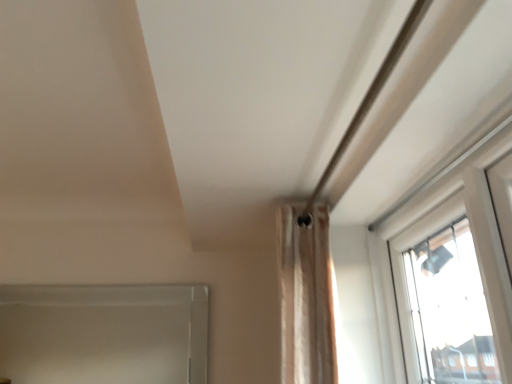
What do you see at coordinates (104, 333) in the screenshot? I see `clear glass window frame at lower left` at bounding box center [104, 333].

What are the coordinates of `clear glass window frame at lower left` in the screenshot? It's located at (104, 333).

The width and height of the screenshot is (512, 384). Describe the element at coordinates (306, 298) in the screenshot. I see `beige fabric curtain at center` at that location.

In order to face beige fabric curtain at center, should I rotate leftwards or rightwards?

A 4.991 degree turn to the right will do.

Locate an element on the screen. The image size is (512, 384). beige fabric curtain at center is located at coordinates (306, 298).

Identify the location of clear glass window frame at lower left. (104, 333).

Considering the positions of objects clear glass window frame at lower left and beige fabric curtain at center in the image provided, who is more to the left, clear glass window frame at lower left or beige fabric curtain at center?

clear glass window frame at lower left is more to the left.

Which is behind, clear glass window frame at lower left or beige fabric curtain at center?

Result: clear glass window frame at lower left.

From the picture: Which is further, (x=90, y=374) or (x=298, y=310)?

Positioned behind is point (x=90, y=374).

From the image's perspective, between clear glass window frame at lower left and beige fabric curtain at center, who is located below?

clear glass window frame at lower left is shown below in the image.

From a real-world perspective, which object stands above the other?

beige fabric curtain at center is physically above.

Which object is wider, clear glass window frame at lower left or beige fabric curtain at center?

beige fabric curtain at center is wider.

In the scene shown: Considering the sizes of objects clear glass window frame at lower left and beige fabric curtain at center in the image provided, who is shorter, clear glass window frame at lower left or beige fabric curtain at center?

With less height is clear glass window frame at lower left.

Considering the sizes of objects clear glass window frame at lower left and beige fabric curtain at center in the image provided, who is bigger, clear glass window frame at lower left or beige fabric curtain at center?

With larger size is beige fabric curtain at center.

Would you say clear glass window frame at lower left contains beige fabric curtain at center?

No, beige fabric curtain at center is located outside of clear glass window frame at lower left.

From the picture: Are clear glass window frame at lower left and beige fabric curtain at center located far from each other?

clear glass window frame at lower left is positioned a significant distance from beige fabric curtain at center.

Is clear glass window frame at lower left looking in the opposite direction of beige fabric curtain at center?

No, clear glass window frame at lower left's orientation is not away from beige fabric curtain at center.

How different are the orientations of clear glass window frame at lower left and beige fabric curtain at center in degrees?

The angular difference between clear glass window frame at lower left and beige fabric curtain at center is 89.8 degrees.

This screenshot has height=384, width=512. I want to click on window frame below the beige fabric curtain at center (from the image's perspective), so click(x=104, y=333).

Which is more to the left, beige fabric curtain at center or clear glass window frame at lower left?

From the viewer's perspective, clear glass window frame at lower left appears more on the left side.

Is the depth of beige fabric curtain at center greater than that of clear glass window frame at lower left?

No, beige fabric curtain at center is closer to the camera.

Is point (325, 348) closer to viewer compared to point (143, 325)?

Yes, it is.

From the image's perspective, would you say beige fabric curtain at center is shown under clear glass window frame at lower left?

No, from the image's perspective, beige fabric curtain at center is not beneath clear glass window frame at lower left.

From a real-world perspective, is beige fabric curtain at center located beneath clear glass window frame at lower left?

Incorrect, from a real-world perspective, beige fabric curtain at center is higher than clear glass window frame at lower left.

Can you confirm if beige fabric curtain at center is wider than clear glass window frame at lower left?

Indeed, beige fabric curtain at center has a greater width compared to clear glass window frame at lower left.

Who is taller, beige fabric curtain at center or clear glass window frame at lower left?

beige fabric curtain at center is taller.

Which of these two, beige fabric curtain at center or clear glass window frame at lower left, is bigger?

beige fabric curtain at center.

Is beige fabric curtain at center surrounding clear glass window frame at lower left?

That's incorrect, clear glass window frame at lower left is not inside beige fabric curtain at center.

Is the surface of beige fabric curtain at center in direct contact with clear glass window frame at lower left?

beige fabric curtain at center and clear glass window frame at lower left are not in contact.

Is beige fabric curtain at center turned away from clear glass window frame at lower left?

No.

The height and width of the screenshot is (384, 512). I want to click on curtain on the right side of clear glass window frame at lower left, so click(306, 298).

At what (x,y) coordinates should I click in order to perform the action: click on curtain located above the clear glass window frame at lower left (from a real-world perspective). Please return your answer as a coordinate pair (x, y). Looking at the image, I should click on (306, 298).

In the image, there is a beige fabric curtain at center. Identify the location of window frame below it (from a real-world perspective). This screenshot has width=512, height=384. click(104, 333).